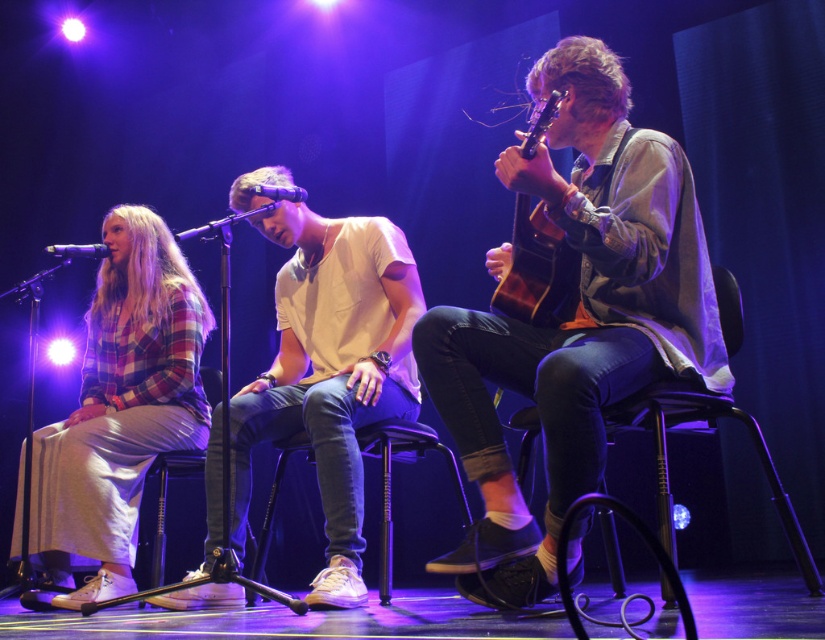
From the picture: You are a photographer taking a picture of the stage. You notice the white cotton shirt at center and the white fabric stool at center. Which one should you focus on to ensure the subject is in sharp focus if you want the closest object to you?

The white cotton shirt at center is closer to the viewer than the white fabric stool at center, so focusing on the white cotton shirt at center will ensure it is in sharp focus as the closest object.

You are standing at the point marked as point (231, 417). There are two microphones on stage. How far apart are they from each other?

The two microphones are 2.59 meters apart.